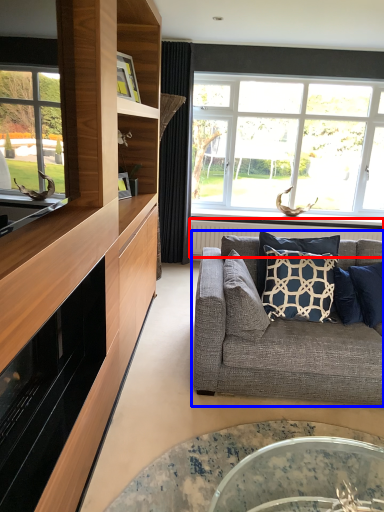
Question: Which of the following is the closest to the observer, radiator (highlighted by a red box) or studio couch (highlighted by a blue box)?

Choices:
 (A) radiator
 (B) studio couch

Answer: (B)